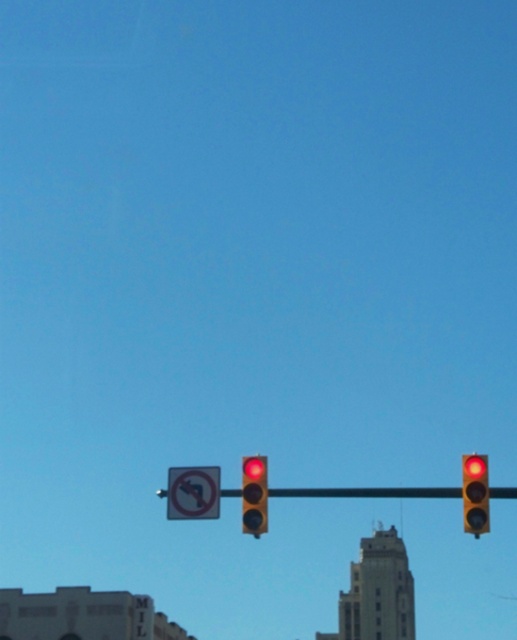
Question: Is black plastic sign at center to the left of matte glass traffic light at upper center from the viewer's perspective?

Choices:
 (A) no
 (B) yes

Answer: (B)

Question: Among these objects, which one is nearest to the camera?

Choices:
 (A) metallic yellow pole at center
 (B) matte glass traffic light at center

Answer: (B)

Question: Which point is farther to the camera?

Choices:
 (A) red glass traffic light at center
 (B) black plastic sign at center
 (C) metallic yellow pole at center

Answer: (C)

Question: Is matte glass traffic light at center smaller than red glass traffic light at center?

Choices:
 (A) no
 (B) yes

Answer: (A)

Question: Estimate the real-world distances between objects in this image. Which object is farther from the red glass traffic light at center?

Choices:
 (A) matte glass traffic light at center
 (B) metallic yellow pole at center
 (C) black plastic sign at center
 (D) matte glass traffic light at upper center

Answer: (B)

Question: Can you confirm if matte glass traffic light at center is smaller than red glass traffic light at center?

Choices:
 (A) no
 (B) yes

Answer: (A)